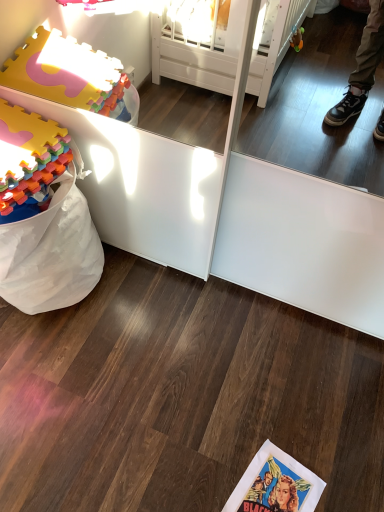
Question: Would you say matte paper comic book at lower center is inside or outside multicolored foam blocks at left?

Choices:
 (A) inside
 (B) outside

Answer: (B)

Question: From their relative heights in the image, would you say matte paper comic book at lower center is taller or shorter than multicolored foam blocks at left?

Choices:
 (A) tall
 (B) short

Answer: (B)

Question: From a real-world perspective, relative to multicolored foam blocks at left, is matte paper comic book at lower center vertically above or below?

Choices:
 (A) above
 (B) below

Answer: (B)

Question: Is multicolored foam blocks at left in front of or behind matte paper comic book at lower center in the image?

Choices:
 (A) behind
 (B) front

Answer: (B)

Question: Based on their sizes in the image, would you say multicolored foam blocks at left is bigger or smaller than matte paper comic book at lower center?

Choices:
 (A) big
 (B) small

Answer: (A)

Question: From the image's perspective, is multicolored foam blocks at left positioned above or below matte paper comic book at lower center?

Choices:
 (A) below
 (B) above

Answer: (B)

Question: In terms of width, does multicolored foam blocks at left look wider or thinner when compared to matte paper comic book at lower center?

Choices:
 (A) thin
 (B) wide

Answer: (B)